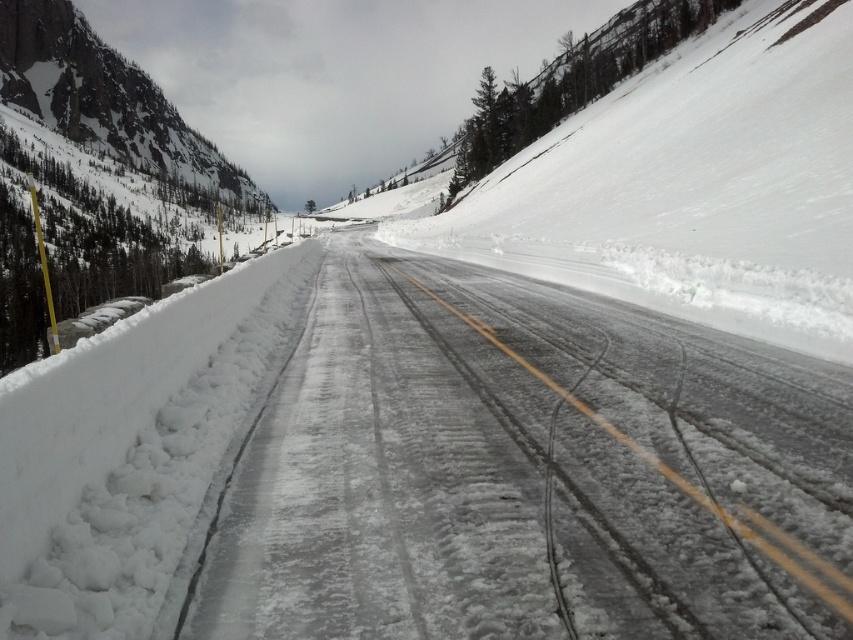
Question: Is snowy asphalt road at center behind snowy rock cliff at upper left?

Choices:
 (A) yes
 (B) no

Answer: (B)

Question: Which point is farther to the camera?

Choices:
 (A) snowy rock cliff at upper left
 (B) snowy asphalt road at center

Answer: (A)

Question: From the image, what is the correct spatial relationship of snowy asphalt road at center in relation to snowy rock cliff at upper left?

Choices:
 (A) above
 (B) below

Answer: (B)

Question: Is snowy asphalt road at center bigger than snowy rock cliff at upper left?

Choices:
 (A) no
 (B) yes

Answer: (A)